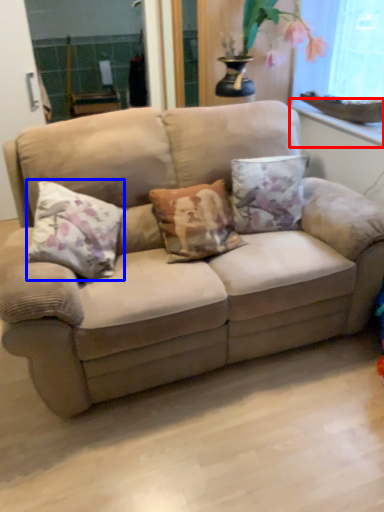
Question: Which object appears farthest to the camera in this image, window sill (highlighted by a red box) or pillow (highlighted by a blue box)?

Choices:
 (A) window sill
 (B) pillow

Answer: (A)